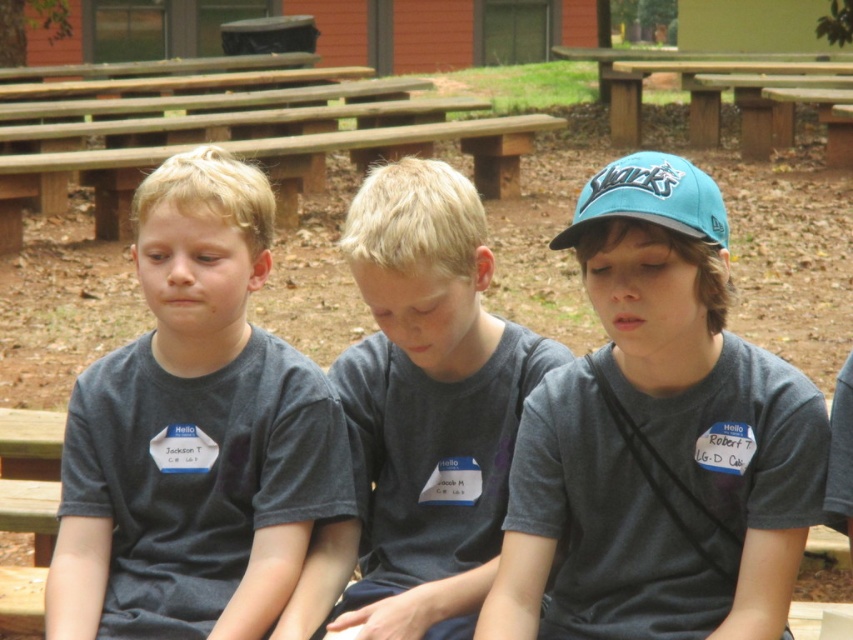
Question: Is dark gray t-shirt at center to the right of wooden picnic table at upper center from the viewer's perspective?

Choices:
 (A) no
 (B) yes

Answer: (A)

Question: Which point appears closest to the camera in this image?

Choices:
 (A) tap(610, 484)
 (B) tap(407, 380)
 (C) tap(650, 170)
 (D) tap(177, 314)

Answer: (C)

Question: Which object is positioned farthest from the matte gray shirt at center?

Choices:
 (A) teal fabric baseball cap at upper right
 (B) dark gray t-shirt at center
 (C) wooden bench at center
 (D) wooden picnic table at upper center

Answer: (D)

Question: Is matte gray shirt at center to the right of teal fabric baseball cap at upper right from the viewer's perspective?

Choices:
 (A) no
 (B) yes

Answer: (B)

Question: Does matte gray shirt at center appear over dark gray t-shirt at center?

Choices:
 (A) yes
 (B) no

Answer: (B)

Question: Which object is closer to the camera taking this photo?

Choices:
 (A) teal fabric baseball cap at upper right
 (B) matte gray shirt at center
 (C) wooden bench at center

Answer: (B)